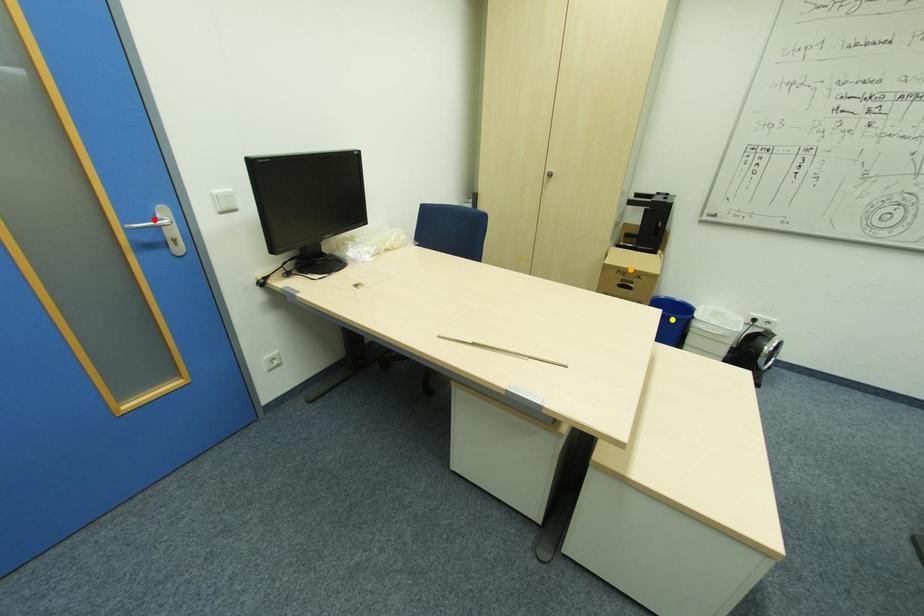
Order these from farthest to nearest:
yellow point | orange point | red point

orange point → yellow point → red point